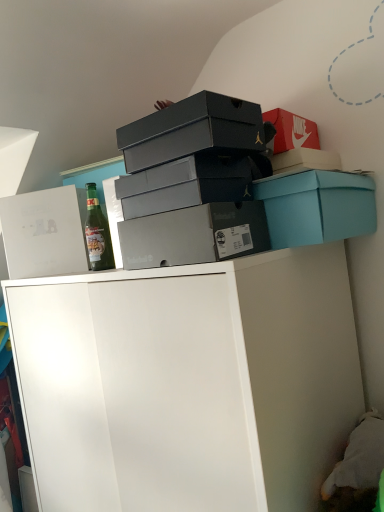
What do you see at coordinates (97, 233) in the screenshot? I see `green glass bottle at left` at bounding box center [97, 233].

Where is `green glass bottle at left`? This screenshot has width=384, height=512. green glass bottle at left is located at coordinates (97, 233).

Where is `white cardboard box at upper left, the fifth box positioned from the right`? white cardboard box at upper left, the fifth box positioned from the right is located at coordinates (45, 232).

This screenshot has height=512, width=384. I want to click on green glass bottle at left, so click(97, 233).

Consider the image. Do you think matte gray shoebox at center, which is the 3th box from left to right, is within matte black shoebox at upper center, the second box when ordered from left to right, or outside of it?

matte gray shoebox at center, which is the 3th box from left to right, is outside matte black shoebox at upper center, the second box when ordered from left to right.

Is matte gray shoebox at center, which is the 3th box from left to right, in contact with matte black shoebox at upper center, the second box when ordered from left to right?

Absolutely, matte gray shoebox at center, which is the 3th box from left to right, is next to and touching matte black shoebox at upper center, the second box when ordered from left to right.

Does matte gray shoebox at center, which is counted as the 3th box, starting from the right, have a smaller size compared to matte black shoebox at upper center, which is the fourth box from right to left?

Indeed, matte gray shoebox at center, which is counted as the 3th box, starting from the right, has a smaller size compared to matte black shoebox at upper center, which is the fourth box from right to left.

Is matte gray shoebox at center, which is the 3th box from left to right, at the right side of matte black shoebox at upper center, which is the fourth box from right to left?

Indeed, matte gray shoebox at center, which is the 3th box from left to right, is positioned on the right side of matte black shoebox at upper center, which is the fourth box from right to left.

Is matte gray shoebox at center, which is counted as the 3th box, starting from the right, not near white matte cabinet at upper center?

That's not correct — matte gray shoebox at center, which is counted as the 3th box, starting from the right, is a little close to white matte cabinet at upper center.

Based on their positions, is matte gray shoebox at center, which is counted as the 3th box, starting from the right, located to the left or right of white matte cabinet at upper center?

From the image, it's evident that matte gray shoebox at center, which is counted as the 3th box, starting from the right, is to the right of white matte cabinet at upper center.

Is matte gray shoebox at center, which is counted as the 3th box, starting from the right, taller or shorter than white matte cabinet at upper center?

Result: Clearly, matte gray shoebox at center, which is counted as the 3th box, starting from the right, is shorter compared to white matte cabinet at upper center.

Is matte gray shoebox at center, which is counted as the 3th box, starting from the right, wider than white matte cabinet at upper center?

In fact, matte gray shoebox at center, which is counted as the 3th box, starting from the right, might be narrower than white matte cabinet at upper center.

Could you tell me if matte gray shoebox at center, placed as the 2th box when sorted from right to left, is turned towards white cardboard box at upper left, marked as the 1th box in a left-to-right arrangement?

No.

Is white cardboard box at upper left, the fifth box positioned from the right, completely or partially inside matte gray shoebox at center, placed as the 2th box when sorted from right to left?

Definitely not — white cardboard box at upper left, the fifth box positioned from the right, is not inside matte gray shoebox at center, placed as the 2th box when sorted from right to left.

Considering the relative positions of matte gray shoebox at center, placed as the 2th box when sorted from right to left, and white cardboard box at upper left, marked as the 1th box in a left-to-right arrangement, in the image provided, is matte gray shoebox at center, placed as the 2th box when sorted from right to left, in front of white cardboard box at upper left, marked as the 1th box in a left-to-right arrangement,?

Yes, the depth of matte gray shoebox at center, placed as the 2th box when sorted from right to left, is less than that of white cardboard box at upper left, marked as the 1th box in a left-to-right arrangement.

You are a GUI agent. You are given a task and a screenshot of the screen. Output one action in this format:
    pyautogui.click(x=<x>, y=<y>)
    Task: Click on the box below the white cardboard box at upper left, marked as the 1th box in a left-to-right arrangement (from the image's perspective)
    This screenshot has width=384, height=512.
    Given the screenshot: What is the action you would take?
    (x=194, y=234)

Is point (229, 303) positioned after point (245, 232)?

No, it is not.

Is white matte cabinet at upper center positioned before matte gray shoebox at center, placed as the 2th box when sorted from right to left?

Yes, it is in front of matte gray shoebox at center, placed as the 2th box when sorted from right to left.

Consider the image. Are white matte cabinet at upper center and matte gray shoebox at center, placed as the 2th box when sorted from right to left, beside each other?

No, white matte cabinet at upper center is not in contact with matte gray shoebox at center, placed as the 2th box when sorted from right to left.

Considering the sizes of objects white cardboard box at upper left, marked as the 1th box in a left-to-right arrangement, and white matte cabinet at upper center in the image provided, who is smaller, white cardboard box at upper left, marked as the 1th box in a left-to-right arrangement, or white matte cabinet at upper center?

With smaller size is white cardboard box at upper left, marked as the 1th box in a left-to-right arrangement.

Considering the sizes of objects white cardboard box at upper left, the fifth box positioned from the right, and white matte cabinet at upper center in the image provided, who is thinner, white cardboard box at upper left, the fifth box positioned from the right, or white matte cabinet at upper center?

white cardboard box at upper left, the fifth box positioned from the right, is thinner.

From a real-world perspective, is white cardboard box at upper left, marked as the 1th box in a left-to-right arrangement, physically located above or below white matte cabinet at upper center?

white cardboard box at upper left, marked as the 1th box in a left-to-right arrangement, is above white matte cabinet at upper center.

From their relative heights in the image, would you say white cardboard box at upper left, marked as the 1th box in a left-to-right arrangement, is taller or shorter than green glass bottle at left?

white cardboard box at upper left, marked as the 1th box in a left-to-right arrangement, is taller than green glass bottle at left.

Considering the relative sizes of white cardboard box at upper left, the fifth box positioned from the right, and green glass bottle at left in the image provided, is white cardboard box at upper left, the fifth box positioned from the right, smaller than green glass bottle at left?

Incorrect, white cardboard box at upper left, the fifth box positioned from the right, is not smaller in size than green glass bottle at left.

Can you confirm if white cardboard box at upper left, marked as the 1th box in a left-to-right arrangement, is positioned to the left of green glass bottle at left?

Yes, white cardboard box at upper left, marked as the 1th box in a left-to-right arrangement, is to the left of green glass bottle at left.

Based on their sizes in the image, would you say green glass bottle at left is bigger or smaller than matte gray shoebox at center, which is counted as the 3th box, starting from the right?

green glass bottle at left is smaller than matte gray shoebox at center, which is counted as the 3th box, starting from the right.

From the image's perspective, who appears lower, green glass bottle at left or matte gray shoebox at center, which is counted as the 3th box, starting from the right?

green glass bottle at left is shown below in the image.

How much distance is there between green glass bottle at left and matte gray shoebox at center, which is counted as the 3th box, starting from the right?

A distance of 11.01 inches exists between green glass bottle at left and matte gray shoebox at center, which is counted as the 3th box, starting from the right.

Relative to matte gray shoebox at center, which is the 3th box from left to right, is green glass bottle at left in front or behind?

In the image, green glass bottle at left appears behind matte gray shoebox at center, which is the 3th box from left to right.

Find the location of `the 2nd box behind when counting from the matte black shoebox at upper center, which is the fourth box from right to left`. the 2nd box behind when counting from the matte black shoebox at upper center, which is the fourth box from right to left is located at coordinates coord(184,184).

Where is `box that is the 4th object located above the white matte cabinet at upper center (from the image's perspective)`? The height and width of the screenshot is (512, 384). box that is the 4th object located above the white matte cabinet at upper center (from the image's perspective) is located at coordinates (184, 184).

Considering their positions, is matte gray shoebox at center, placed as the 2th box when sorted from right to left, positioned further to matte black shoebox at upper center, which is the fourth box from right to left, than teal cardboard box at upper right, arranged as the 1th box when viewed from the right?

Based on the image, teal cardboard box at upper right, arranged as the 1th box when viewed from the right, appears to be further to matte black shoebox at upper center, which is the fourth box from right to left.

Considering their positions, is teal cardboard box at upper right, which is counted as the fifth box, starting from the left, positioned closer to matte gray shoebox at center, which appears as the 4th box when viewed from the left, than green glass bottle at left?

teal cardboard box at upper right, which is counted as the fifth box, starting from the left, is closer to matte gray shoebox at center, which appears as the 4th box when viewed from the left.

Based on the photo, based on their spatial positions, is teal cardboard box at upper right, arranged as the 1th box when viewed from the right, or green glass bottle at left closer to white matte cabinet at upper center?

Based on the image, teal cardboard box at upper right, arranged as the 1th box when viewed from the right, appears to be nearer to white matte cabinet at upper center.

Which object lies nearer to the anchor point teal cardboard box at upper right, which is counted as the fifth box, starting from the left, green glass bottle at left or matte gray shoebox at center, which is the 3th box from left to right?

matte gray shoebox at center, which is the 3th box from left to right, is positioned closer to the anchor teal cardboard box at upper right, which is counted as the fifth box, starting from the left.

Looking at the image, which one is located further to green glass bottle at left, white matte cabinet at upper center or white cardboard box at upper left, the fifth box positioned from the right?

white matte cabinet at upper center is positioned further to the anchor green glass bottle at left.

Estimate the real-world distances between objects in this image. Which object is closer to matte gray shoebox at center, which appears as the 4th box when viewed from the left, matte black shoebox at upper center, the second box when ordered from left to right, or white matte cabinet at upper center?

matte black shoebox at upper center, the second box when ordered from left to right, is positioned closer to the anchor matte gray shoebox at center, which appears as the 4th box when viewed from the left.

When comparing their distances from white cardboard box at upper left, the fifth box positioned from the right, does green glass bottle at left or teal cardboard box at upper right, which is counted as the fifth box, starting from the left, seem closer?

Based on the image, green glass bottle at left appears to be nearer to white cardboard box at upper left, the fifth box positioned from the right.

Considering their positions, is matte black shoebox at upper center, the second box when ordered from left to right, positioned further to green glass bottle at left than matte gray shoebox at center, which is counted as the 3th box, starting from the right?

matte black shoebox at upper center, the second box when ordered from left to right, is further to green glass bottle at left.

You are a GUI agent. You are given a task and a screenshot of the screen. Output one action in this format:
    pyautogui.click(x=<x>, y=<y>)
    Task: Click on the box between matte gray shoebox at center, which is the 3th box from left to right, and teal cardboard box at upper right, arranged as the 1th box when viewed from the right, from left to right
    The width and height of the screenshot is (384, 512).
    Given the screenshot: What is the action you would take?
    pyautogui.click(x=194, y=234)

Find the location of `bottle between teal cardboard box at upper right, which is counted as the fifth box, starting from the left, and white matte cabinet at upper center from top to bottom`. bottle between teal cardboard box at upper right, which is counted as the fifth box, starting from the left, and white matte cabinet at upper center from top to bottom is located at coordinates (97, 233).

Identify the location of bottle between white cardboard box at upper left, marked as the 1th box in a left-to-right arrangement, and teal cardboard box at upper right, which is counted as the fifth box, starting from the left. (97, 233).

The width and height of the screenshot is (384, 512). What are the coordinates of `bottle between matte gray shoebox at center, which is the 3th box from left to right, and white cardboard box at upper left, the fifth box positioned from the right, along the z-axis` in the screenshot? It's located at (97, 233).